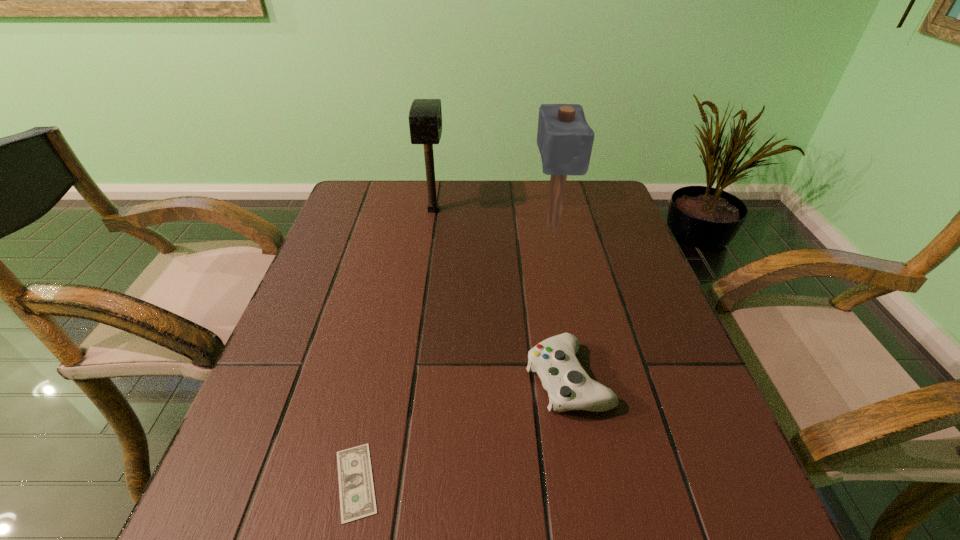
Find the location of a particular element. The width and height of the screenshot is (960, 540). the right mallet is located at coordinates (565, 140).

The height and width of the screenshot is (540, 960). I want to click on the left mallet, so click(x=425, y=116).

Locate an element on the screen. This screenshot has height=540, width=960. the third tallest object is located at coordinates (569, 387).

You are a GUI agent. You are given a task and a screenshot of the screen. Output one action in this format:
    pyautogui.click(x=<x>, y=<y>)
    Task: Click on the control
    Image resolution: width=960 pixels, height=540 pixels.
    Given the screenshot: What is the action you would take?
    pyautogui.click(x=569, y=387)

The width and height of the screenshot is (960, 540). I want to click on the nearest object, so click(x=357, y=498).

Identify the location of money. The height and width of the screenshot is (540, 960). (357, 498).

Find the location of `vacant area located on the front of the right mallet`. vacant area located on the front of the right mallet is located at coordinates [x=569, y=306].

Image resolution: width=960 pixels, height=540 pixels. I want to click on free space located on the back of the left mallet, so click(437, 184).

At what (x,y) coordinates should I click in order to perform the action: click on free space located on the back of the control. Please return your answer as a coordinate pair (x, y). Looking at the image, I should click on (547, 266).

Identify the location of free space located on the back of the money. (392, 310).